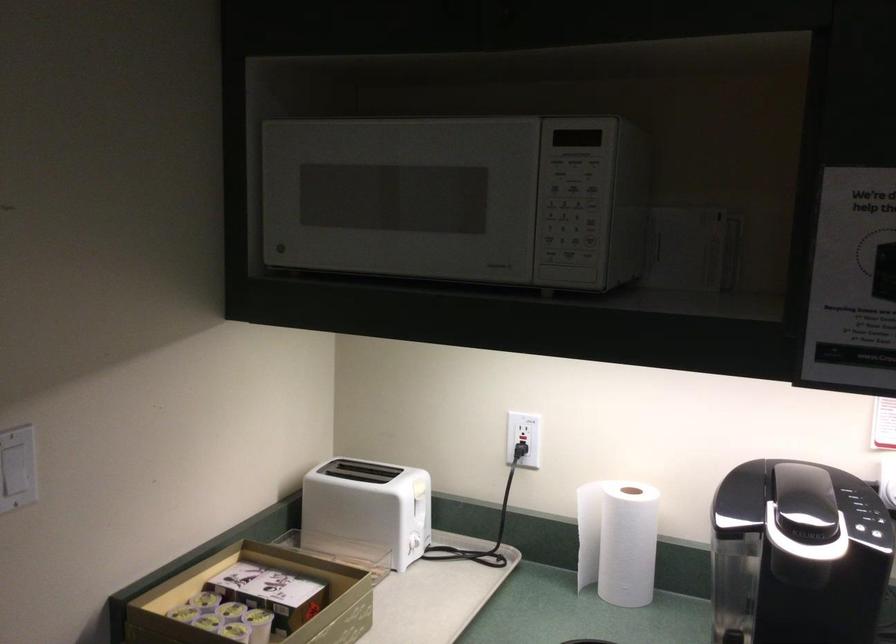
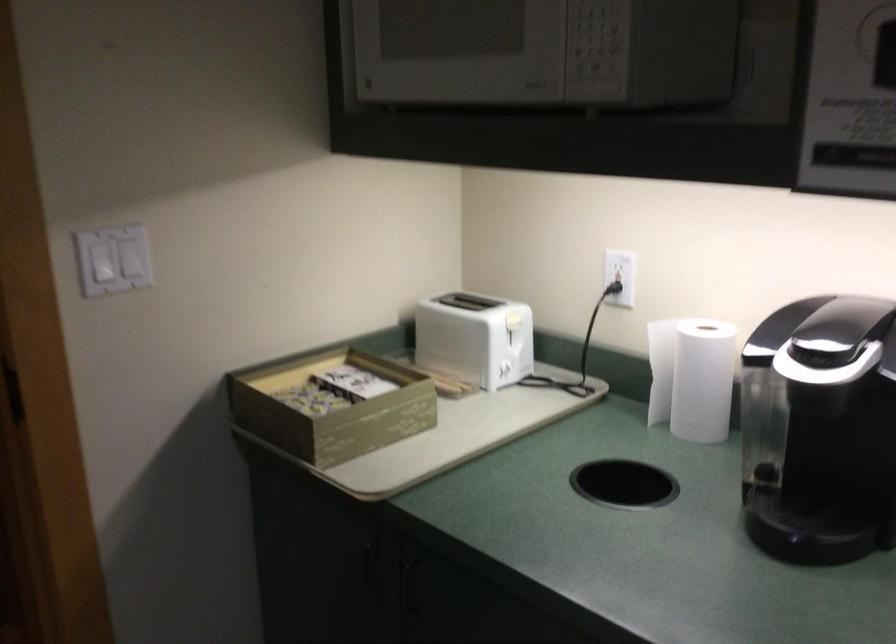
Question: Which direction would the cameraman need to move to produce the second image? Reply with the corresponding letter.

Choices:
 (A) Left
 (B) Right
 (C) Forward
 (D) Backward

Answer: (B)